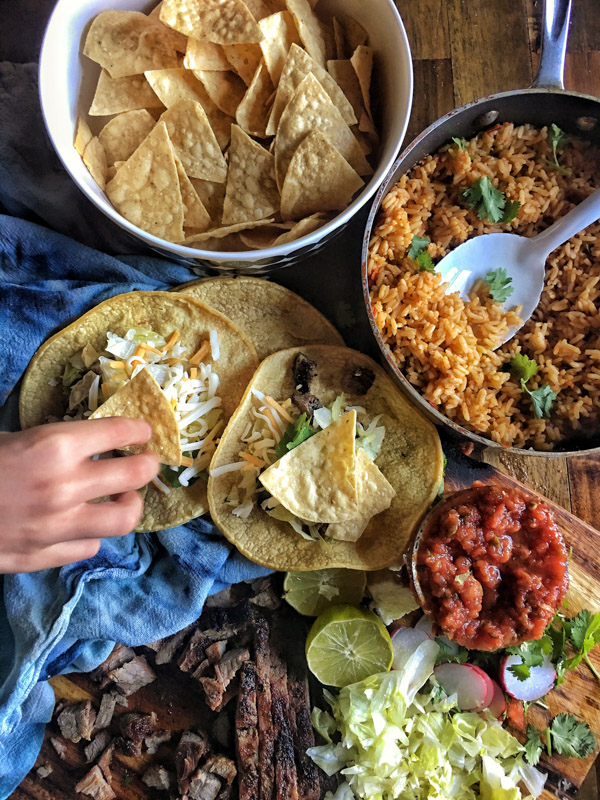
What are the coordinates of `table` in the screenshot? It's located at point(551,478), point(551,760).